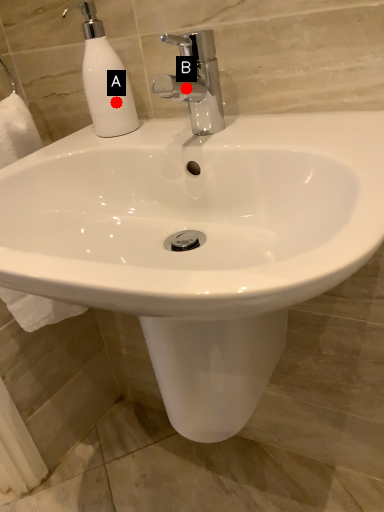
Question: Two points are circled on the image, labeled by A and B beside each circle. Among these points, which one is farthest from the camera?

Choices:
 (A) A is further
 (B) B is further

Answer: (A)